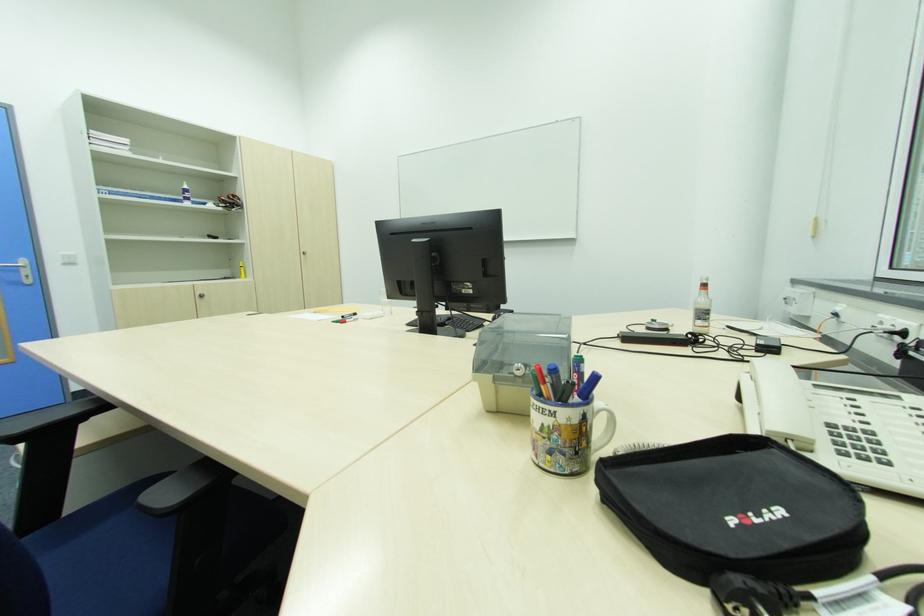
Where would you grasp the white spray bottle? Please return your answer as a coordinate pair (x, y).

(701, 308)